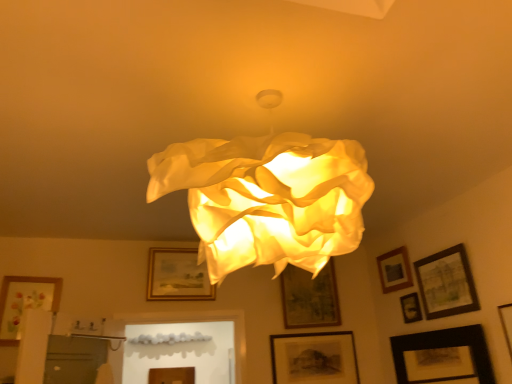
Question: Is black matte picture frame at lower right, arranged as the eighth picture frame when viewed from the left, completely or partially inside matte black picture frame at lower right, placed as the seventh picture frame when sorted from left to right?

Choices:
 (A) no
 (B) yes

Answer: (A)

Question: From a real-world perspective, is matte black picture frame at lower right, the 4th picture frame viewed from the right, positioned over black matte picture frame at lower right, arranged as the eighth picture frame when viewed from the left, based on gravity?

Choices:
 (A) no
 (B) yes

Answer: (B)

Question: Could you tell me if matte black picture frame at lower right, the 4th picture frame viewed from the right, is facing black matte picture frame at lower right, the third picture frame in the right-to-left sequence?

Choices:
 (A) yes
 (B) no

Answer: (B)

Question: Are matte black picture frame at lower right, the 4th picture frame viewed from the right, and black matte picture frame at lower right, arranged as the eighth picture frame when viewed from the left, making contact?

Choices:
 (A) yes
 (B) no

Answer: (B)

Question: Is matte black picture frame at lower right, the 4th picture frame viewed from the right, wider than black matte picture frame at lower right, the third picture frame in the right-to-left sequence?

Choices:
 (A) yes
 (B) no

Answer: (B)

Question: In terms of width, does black matte picture frame at lower right, arranged as the eighth picture frame when viewed from the left, look wider or thinner when compared to matte floral print picture frame at lower left, the 1th picture frame viewed from the left?

Choices:
 (A) thin
 (B) wide

Answer: (A)

Question: Do you think black matte picture frame at lower right, the third picture frame in the right-to-left sequence, is within matte floral print picture frame at lower left, the 1th picture frame viewed from the left, or outside of it?

Choices:
 (A) outside
 (B) inside

Answer: (A)

Question: From a real-world perspective, is black matte picture frame at lower right, arranged as the eighth picture frame when viewed from the left, physically located above or below matte floral print picture frame at lower left, which is the tenth picture frame in right-to-left order?

Choices:
 (A) above
 (B) below

Answer: (B)

Question: From their relative heights in the image, would you say black matte picture frame at lower right, the third picture frame in the right-to-left sequence, is taller or shorter than matte floral print picture frame at lower left, the 1th picture frame viewed from the left?

Choices:
 (A) tall
 (B) short

Answer: (B)

Question: Considering the positions of wooden framed picture at center, which appears as the 4th picture frame when viewed from the left, and wooden framed picture at center, placed as the eighth picture frame when sorted from right to left, in the image, is wooden framed picture at center, which appears as the 4th picture frame when viewed from the left, taller or shorter than wooden framed picture at center, placed as the eighth picture frame when sorted from right to left,?

Choices:
 (A) short
 (B) tall

Answer: (B)

Question: Is wooden framed picture at center, which ranks as the 7th picture frame in right-to-left order, situated inside wooden framed picture at center, marked as the third picture frame in a left-to-right arrangement, or outside?

Choices:
 (A) inside
 (B) outside

Answer: (B)

Question: From the image's perspective, relative to wooden framed picture at center, placed as the eighth picture frame when sorted from right to left, is wooden framed picture at center, which ranks as the 7th picture frame in right-to-left order, above or below?

Choices:
 (A) below
 (B) above

Answer: (A)

Question: Is wooden framed picture at center, which appears as the 4th picture frame when viewed from the left, in front of or behind wooden framed picture at center, placed as the eighth picture frame when sorted from right to left, in the image?

Choices:
 (A) behind
 (B) front

Answer: (A)

Question: Which is correct: wooden framed picture at center, which ranks as the 7th picture frame in right-to-left order, is inside wooden picture frame at lower center, which is the 2th picture frame in left-to-right order, or outside of it?

Choices:
 (A) inside
 (B) outside

Answer: (B)

Question: Does point (284, 307) appear closer or farther from the camera than point (177, 375)?

Choices:
 (A) farther
 (B) closer

Answer: (B)